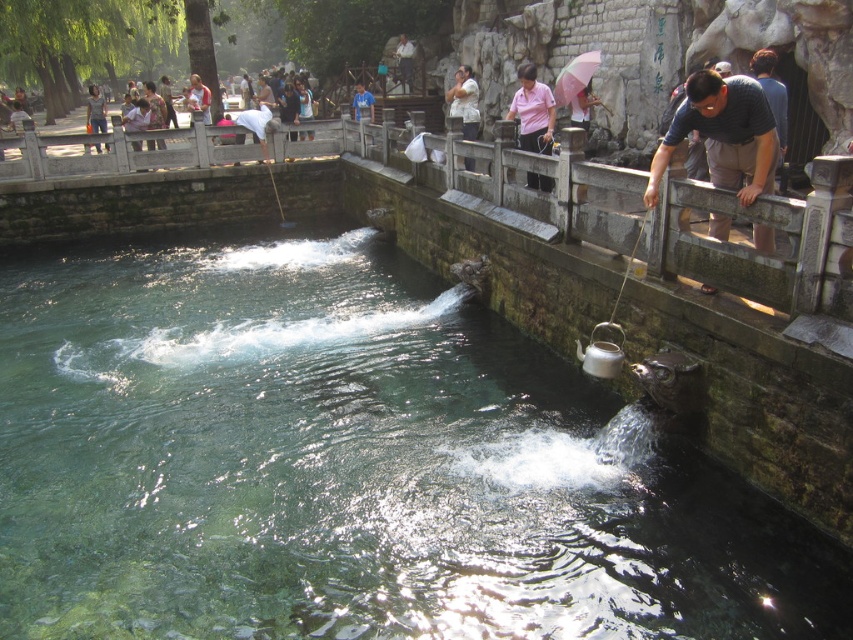
You are a photographer standing at the edge of the water body. You want to take a photo of the pink cotton shirt at center and the clear glass water at center. If your camera has a depth of field that can focus on objects within a 5 meter range, will both objects be in focus?

The clear glass water at center is 6.84 meters away from the pink cotton shirt at center. Since the distance between them exceeds the 5 meter range of the camera, both objects cannot be in focus simultaneously.

You are a photographer planning to take a photo of the stone railing at right and the dark blue shirt at upper right. Based on their positions, which object is closer to the camera?

The stone railing at right is positioned over the dark blue shirt at upper right, so it is closer to the camera.

You are a photographer wanting to capture both the stone railing at right and the dark blue shirt at upper right in the same frame. Which object should you position closer to the camera to ensure both are in focus?

The stone railing at right is taller than the dark blue shirt at upper right. To ensure both are in focus, position the stone railing at right closer to the camera since it is taller and requires more depth of field.